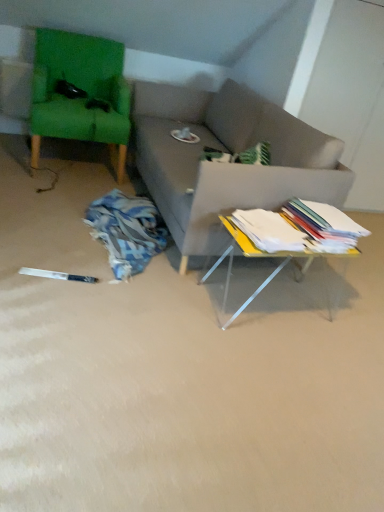
Question: Should I look upward or downward to see white paper stack at center, arranged as the first book when viewed from the left?

Choices:
 (A) up
 (B) down

Answer: (A)

Question: From a real-world perspective, is white paper stack at center, arranged as the first book when viewed from the left, physically below yellow acrylic table at lower right?

Choices:
 (A) yes
 (B) no

Answer: (B)

Question: Is white paper stack at center, which is counted as the second book, starting from the right, next to yellow acrylic table at lower right?

Choices:
 (A) yes
 (B) no

Answer: (B)

Question: Could you tell me if white paper stack at center, arranged as the first book when viewed from the left, is turned towards yellow acrylic table at lower right?

Choices:
 (A) no
 (B) yes

Answer: (A)

Question: Does white paper stack at center, arranged as the first book when viewed from the left, have a greater width compared to yellow acrylic table at lower right?

Choices:
 (A) no
 (B) yes

Answer: (A)

Question: Can you confirm if white paper stack at center, which is counted as the second book, starting from the right, is positioned to the left of yellow acrylic table at lower right?

Choices:
 (A) no
 (B) yes

Answer: (B)

Question: Can you confirm if white paper stack at center, which is counted as the second book, starting from the right, is smaller than yellow acrylic table at lower right?

Choices:
 (A) yes
 (B) no

Answer: (A)

Question: Is yellow acrylic table at lower right smaller than white paper stack at center, arranged as the first book when viewed from the left?

Choices:
 (A) no
 (B) yes

Answer: (A)

Question: Is white paper stack at center, which is counted as the second book, starting from the right, inside yellow acrylic table at lower right?

Choices:
 (A) yes
 (B) no

Answer: (B)

Question: Is yellow acrylic table at lower right not within white paper stack at center, which is counted as the second book, starting from the right?

Choices:
 (A) yes
 (B) no

Answer: (A)

Question: Considering the relative positions of yellow acrylic table at lower right and white paper stack at center, which is counted as the second book, starting from the right, in the image provided, is yellow acrylic table at lower right to the right of white paper stack at center, which is counted as the second book, starting from the right, from the viewer's perspective?

Choices:
 (A) yes
 (B) no

Answer: (A)

Question: Does yellow acrylic table at lower right have a lesser width compared to white paper stack at center, which is counted as the second book, starting from the right?

Choices:
 (A) no
 (B) yes

Answer: (A)

Question: Is yellow acrylic table at lower right aimed at white paper stack at center, arranged as the first book when viewed from the left?

Choices:
 (A) yes
 (B) no

Answer: (B)

Question: Can you confirm if white paper stack at center, arranged as the first book when viewed from the left, is thinner than white paper stack at right, positioned as the 1th book in right-to-left order?

Choices:
 (A) no
 (B) yes

Answer: (B)